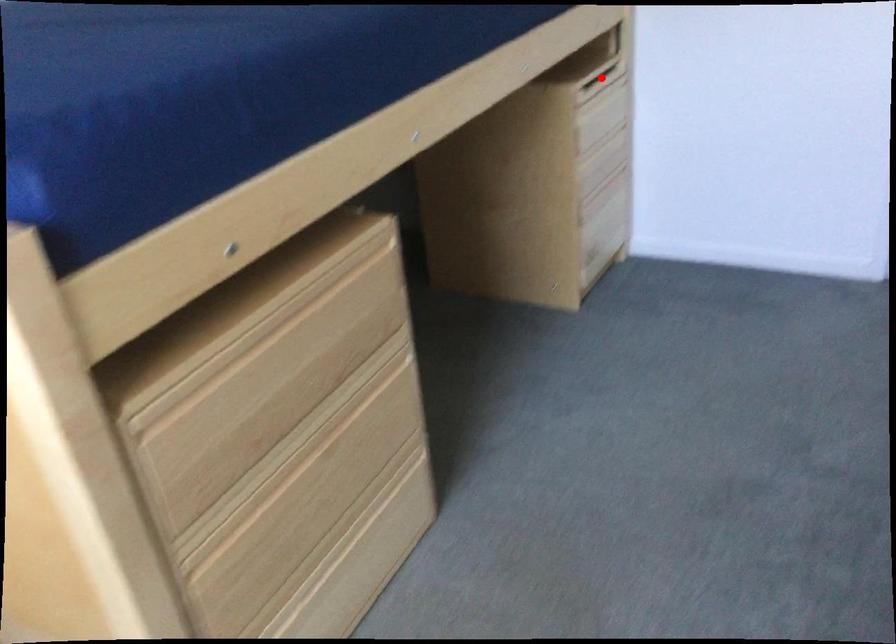
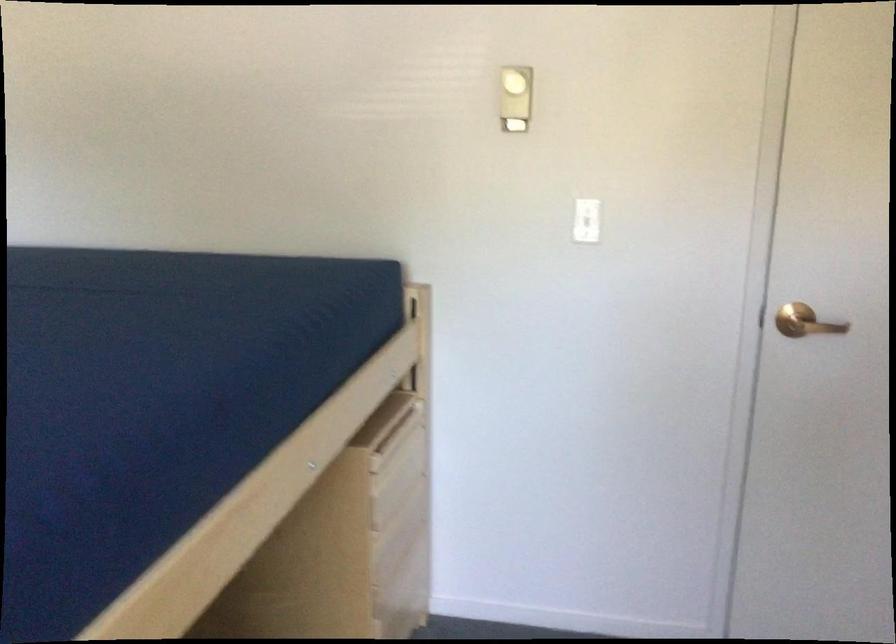
Question: I am providing you with two images of the same scene from different viewpoints. Image1 has a red point marked. In image2, the corresponding 3D location appears at what relative position? Reply with the corresponding letter.

Choices:
 (A) Closer
 (B) Farther

Answer: (A)